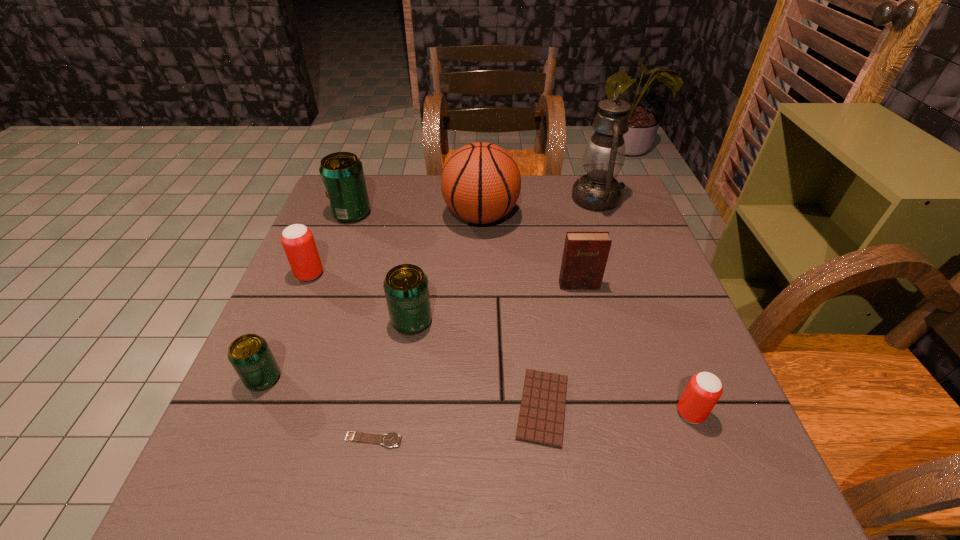
The width and height of the screenshot is (960, 540). I want to click on basketball that is at the far edge, so click(x=480, y=183).

The image size is (960, 540). Find the location of `beer can that is at the far edge`. beer can that is at the far edge is located at coordinates (342, 175).

Find the location of a particular element. oil lamp located in the right edge section of the desktop is located at coordinates (604, 156).

Identify the location of beer can positioned at the right edge. (703, 391).

Identify the location of object positioned at the far left corner. (342, 175).

At what (x,y) coordinates should I click in order to perform the action: click on object positioned at the far right corner. Please return your answer as a coordinate pair (x, y). This screenshot has width=960, height=540. Looking at the image, I should click on (604, 156).

The height and width of the screenshot is (540, 960). I want to click on vacant space at the far edge, so click(x=534, y=220).

I want to click on vacant position at the near edge of the desktop, so click(x=367, y=483).

Find the location of a particular element. The width and height of the screenshot is (960, 540). vacant space at the left edge is located at coordinates (369, 231).

Where is `vacant space at the right edge of the desktop`? vacant space at the right edge of the desktop is located at coordinates 667,364.